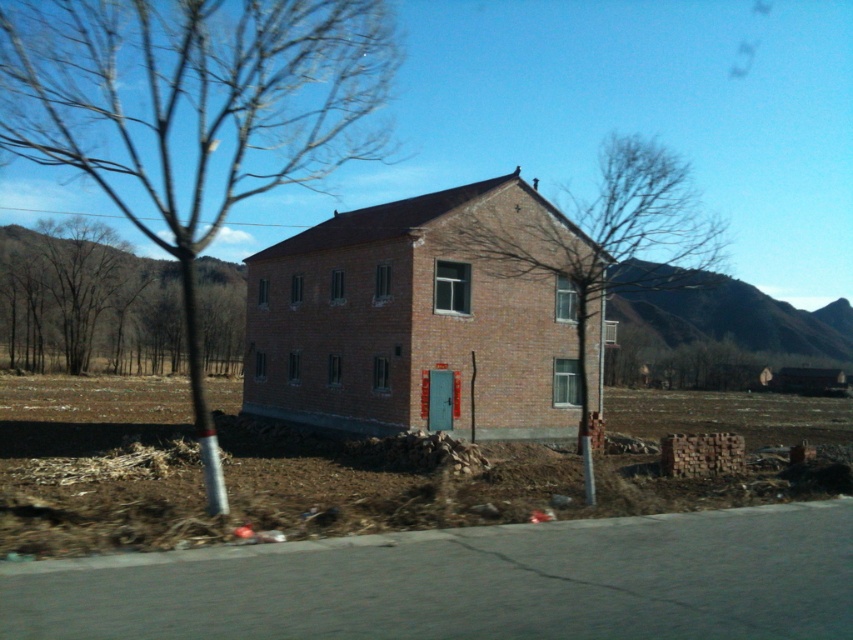
Question: Is bare branches at center above bare wood tree at center?

Choices:
 (A) no
 (B) yes

Answer: (B)

Question: Which object appears farthest from the camera in this image?

Choices:
 (A) bare branches at center
 (B) brown leafless tree at center
 (C) bare wood tree at center

Answer: (C)

Question: Can you confirm if bare branches at center is positioned above brown leafless tree at center?

Choices:
 (A) no
 (B) yes

Answer: (B)

Question: Is bare branches at center to the right of brown leafless tree at center from the viewer's perspective?

Choices:
 (A) no
 (B) yes

Answer: (A)

Question: Which object is positioned farthest from the bare wood tree at center?

Choices:
 (A) brown leafless tree at center
 (B) bare branches at center

Answer: (A)

Question: Based on their relative distances, which object is nearer to the bare wood tree at center?

Choices:
 (A) bare branches at center
 (B) brown leafless tree at center

Answer: (A)